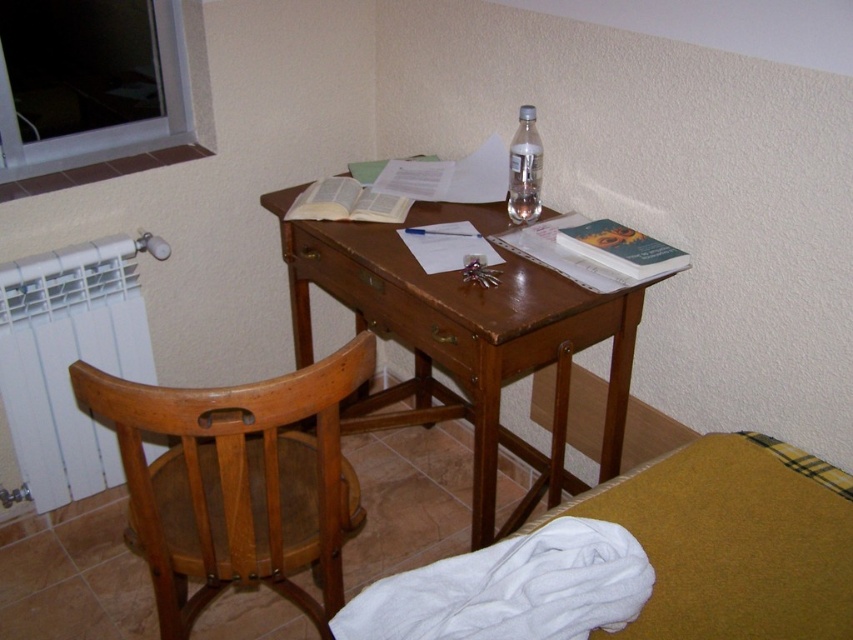
Is point (350, 353) positioned behind point (316, 241)?

No, it is not.

Is wooden chair at left closer to the viewer compared to brown wood drawer at center?

Yes, it is in front of brown wood drawer at center.

Who is more forward, (212,467) or (316,248)?

Positioned in front is point (212,467).

You are a GUI agent. You are given a task and a screenshot of the screen. Output one action in this format:
    pyautogui.click(x=<x>, y=<y>)
    Task: Click on the wooden chair at left
    The height and width of the screenshot is (640, 853).
    Given the screenshot: What is the action you would take?
    pyautogui.click(x=236, y=483)

Is wooden chair at left smaller than clear glass bottle at center?

No.

Who is higher up, wooden chair at left or clear glass bottle at center?

clear glass bottle at center

Describe the element at coordinates (236, 483) in the screenshot. The height and width of the screenshot is (640, 853). I see `wooden chair at left` at that location.

The width and height of the screenshot is (853, 640). Find the location of `wooden chair at left`. wooden chair at left is located at coordinates (236, 483).

Which is more to the right, white plastic radiator at lower left or brown wood drawer at center?

brown wood drawer at center is more to the right.

Can you confirm if white plastic radiator at lower left is shorter than brown wood drawer at center?

No, white plastic radiator at lower left is not shorter than brown wood drawer at center.

Who is more forward, (82,456) or (350,272)?

Point (350,272) is more forward.

At what (x,y) coordinates should I click in order to perform the action: click on white plastic radiator at lower left. Please return your answer as a coordinate pair (x, y). The image size is (853, 640). Looking at the image, I should click on (70, 358).